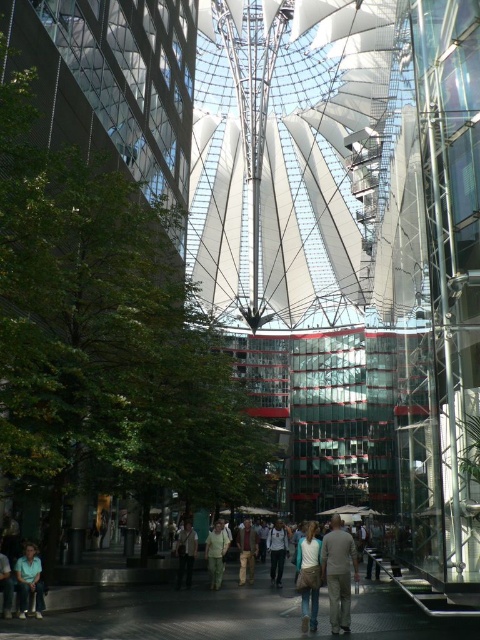
You are standing in the atrium and need to walk through the space between the light brown fabric pants at lower right and the brown leather jacket at center. If your path is 1.2 meters wide, can you pass through comfortably?

The light brown fabric pants at lower right might be wider than brown leather jacket at center, so the path between them may be narrower than 1.2 meters. It is uncertain if you can pass through comfortably without more information about their exact widths.

You are standing in the atrium and want to place a small potted plant between the denim jacket at center and the light blue jeans at lower left. Considering their positions and sizes, where should you position the plant so it doesn

The denim jacket at center is taller than the light blue jeans at lower left. To place the plant between them, position it closer to the light blue jeans at lower left to ensure stability and balance given the height difference.

You are standing in the atrium and need to find an item. You see the light brown fabric pants at lower right and the brown leather jacket at center. Which item is positioned more to the east side of the atrium?

The light brown fabric pants at lower right is positioned to the right of the brown leather jacket at center. Since the jacket is at the center, the pants are more to the east side of the atrium.